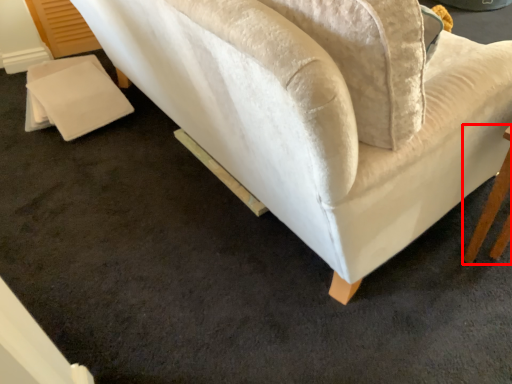
Question: Where is table (annotated by the red box) located in relation to studio couch in the image?

Choices:
 (A) right
 (B) left

Answer: (A)